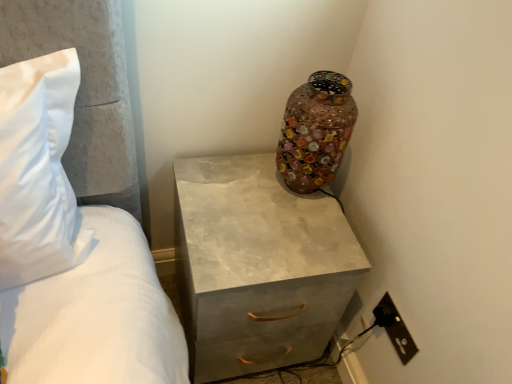
Locate an element on the screen. free spot above matte concrete chest of drawers at center (from a real-world perspective) is located at coordinates (253, 207).